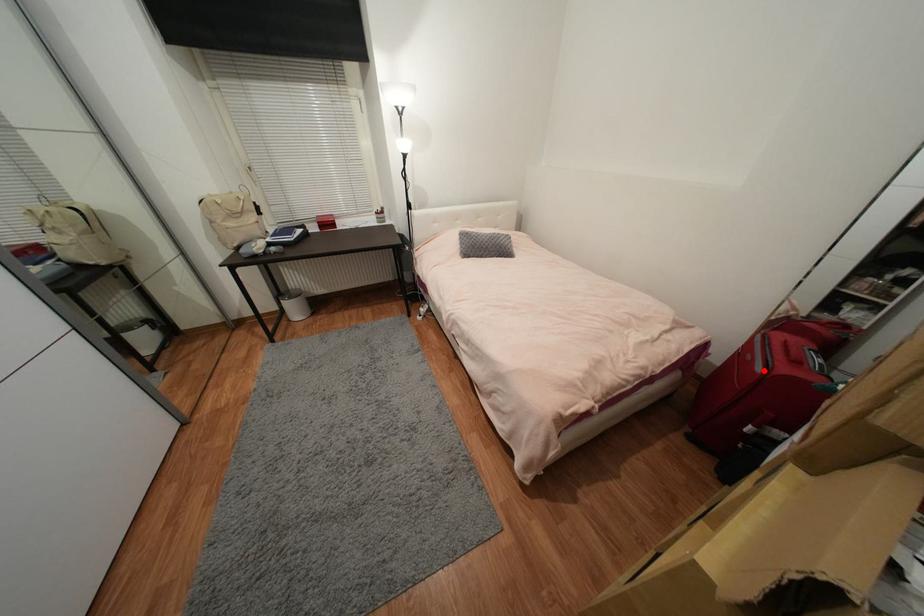
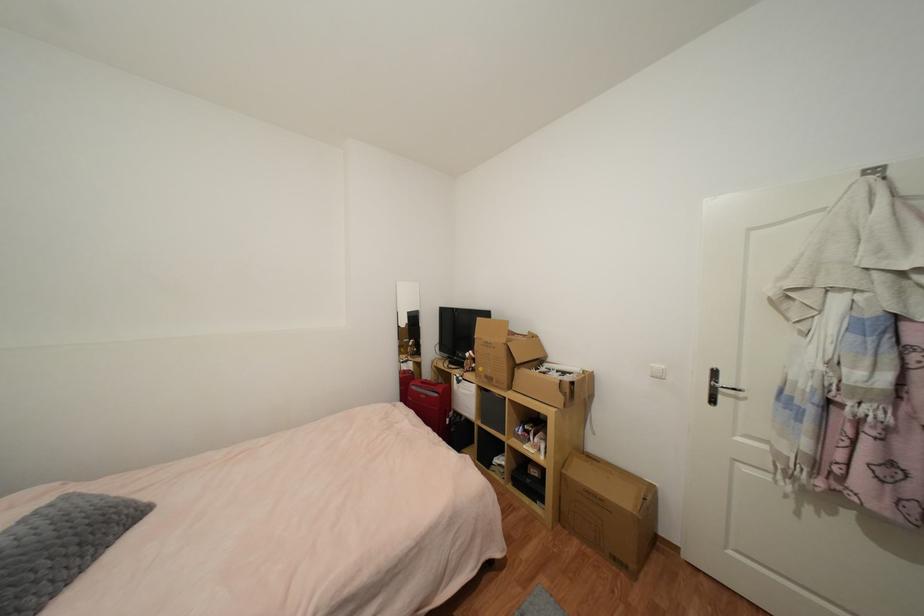
The point at the highlighted location is marked in the first image. Where is the corresponding point in the second image?

(440, 397)